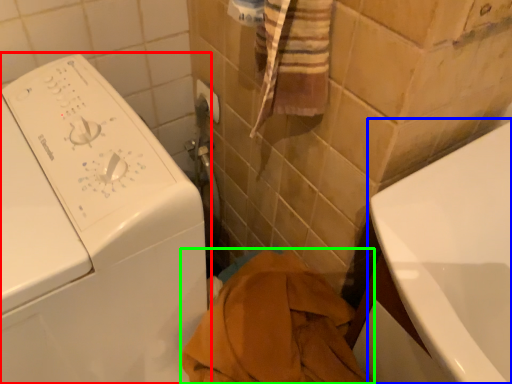
Question: Which object is the closest to the washing machine (highlighted by a red box)? Choose among these: bath (highlighted by a blue box) or bath towel (highlighted by a green box).

Choices:
 (A) bath
 (B) bath towel

Answer: (B)